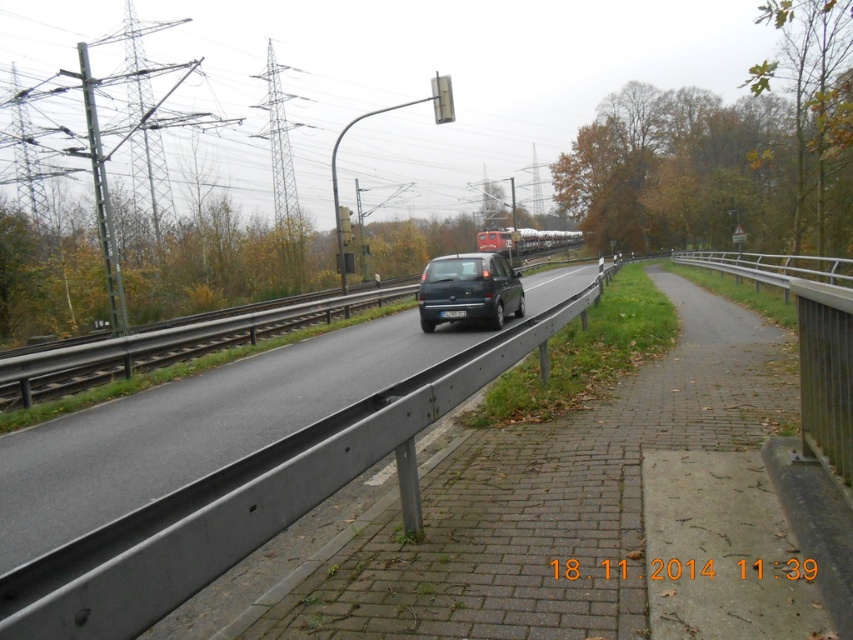
Based on the photo, is white plastic traffic light at upper center to the left of metallic gray traffic light at center from the viewer's perspective?

No, white plastic traffic light at upper center is not to the left of metallic gray traffic light at center.

Is point (433, 76) in front of point (341, 211)?

No, (433, 76) is behind (341, 211).

Image resolution: width=853 pixels, height=640 pixels. Describe the element at coordinates (442, 99) in the screenshot. I see `white plastic traffic light at upper center` at that location.

The height and width of the screenshot is (640, 853). I want to click on white plastic traffic light at upper center, so click(x=442, y=99).

Is point (112, 348) positioned behind point (479, 282)?

No.

Is point (32, 376) positioned in front of point (436, 296)?

Yes, it is in front of point (436, 296).

The width and height of the screenshot is (853, 640). I want to click on black asphalt train track at center, so click(x=167, y=346).

Is matte black van at center bigger than white plastic traffic light at upper center?

No, matte black van at center is not bigger than white plastic traffic light at upper center.

Between matte black van at center and white plastic traffic light at upper center, which one has less height?

Standing shorter between the two is matte black van at center.

The width and height of the screenshot is (853, 640). What do you see at coordinates (525, 240) in the screenshot?
I see `matte black van at center` at bounding box center [525, 240].

The height and width of the screenshot is (640, 853). I want to click on matte black van at center, so click(x=525, y=240).